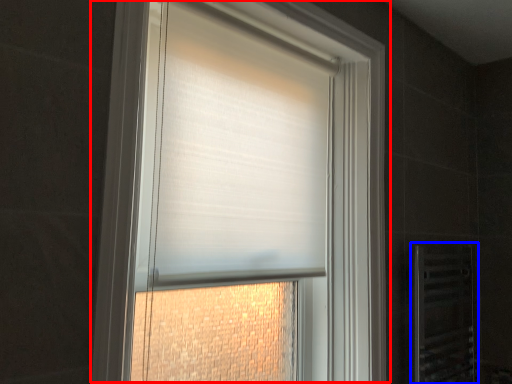
Question: Which point is closer to the camera, window (highlighted by a red box) or screen door (highlighted by a blue box)?

Choices:
 (A) window
 (B) screen door

Answer: (A)